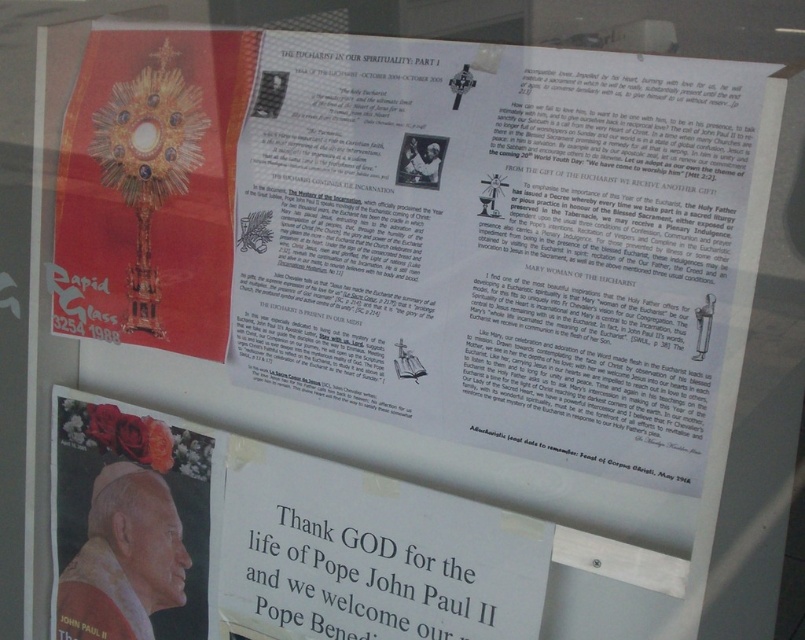
Measure the distance between gold metallic monstrance at upper left and white paper at center.

A distance of 25.09 centimeters exists between gold metallic monstrance at upper left and white paper at center.

Does point (135, 141) lie behind point (312, 561)?

Yes.

Image resolution: width=805 pixels, height=640 pixels. In order to click on gold metallic monstrance at upper left in this screenshot , I will do `click(151, 188)`.

Is gold metallic monstrance at upper left closer to the viewer compared to white matte portrait of pope john paul ii at lower left?

Yes.

Is gold metallic monstrance at upper left shorter than white matte portrait of pope john paul ii at lower left?

Incorrect, gold metallic monstrance at upper left's height does not fall short of white matte portrait of pope john paul ii at lower left's.

Is point (168, 323) more distant than point (147, 452)?

No, (168, 323) is closer to viewer.

Identify the location of gold metallic monstrance at upper left. This screenshot has height=640, width=805. (151, 188).

Between white paper at center and white matte portrait of pope john paul ii at lower left, which one is positioned higher?

white matte portrait of pope john paul ii at lower left is higher up.

The image size is (805, 640). Find the location of `white paper at center`. white paper at center is located at coordinates (370, 566).

The image size is (805, 640). In order to click on white paper at center in this screenshot , I will do `click(370, 566)`.